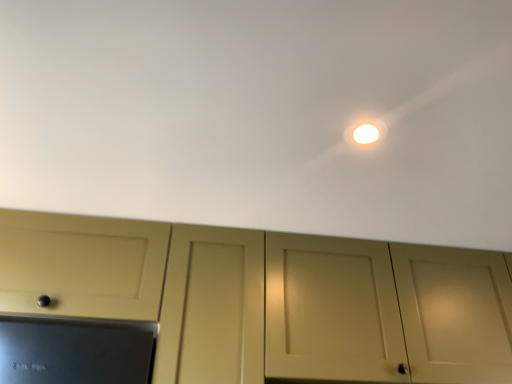
Question: From a real-world perspective, is white matte ceiling at upper center positioned under white glossy light at upper center based on gravity?

Choices:
 (A) no
 (B) yes

Answer: (A)

Question: Is white matte ceiling at upper center not inside white glossy light at upper center?

Choices:
 (A) yes
 (B) no

Answer: (A)

Question: Is white matte ceiling at upper center behind white glossy light at upper center?

Choices:
 (A) no
 (B) yes

Answer: (A)

Question: From the image's perspective, is white matte ceiling at upper center over white glossy light at upper center?

Choices:
 (A) yes
 (B) no

Answer: (B)

Question: Considering the relative sizes of white matte ceiling at upper center and white glossy light at upper center in the image provided, is white matte ceiling at upper center shorter than white glossy light at upper center?

Choices:
 (A) yes
 (B) no

Answer: (B)

Question: Is white matte ceiling at upper center thinner than white glossy light at upper center?

Choices:
 (A) no
 (B) yes

Answer: (A)

Question: Is matte cream cabinet at center oriented away from white matte ceiling at upper center?

Choices:
 (A) no
 (B) yes

Answer: (A)

Question: From the image's perspective, would you say matte cream cabinet at center is positioned over white matte ceiling at upper center?

Choices:
 (A) yes
 (B) no

Answer: (B)

Question: Could you tell me if matte cream cabinet at center is turned towards white matte ceiling at upper center?

Choices:
 (A) no
 (B) yes

Answer: (B)

Question: Does matte cream cabinet at center have a lesser height compared to white matte ceiling at upper center?

Choices:
 (A) yes
 (B) no

Answer: (B)

Question: Is matte cream cabinet at center further to the viewer compared to white matte ceiling at upper center?

Choices:
 (A) yes
 (B) no

Answer: (A)

Question: Considering the relative sizes of matte cream cabinet at center and white matte ceiling at upper center in the image provided, is matte cream cabinet at center smaller than white matte ceiling at upper center?

Choices:
 (A) no
 (B) yes

Answer: (A)

Question: Does white glossy light at upper center appear on the left side of white matte ceiling at upper center?

Choices:
 (A) no
 (B) yes

Answer: (A)